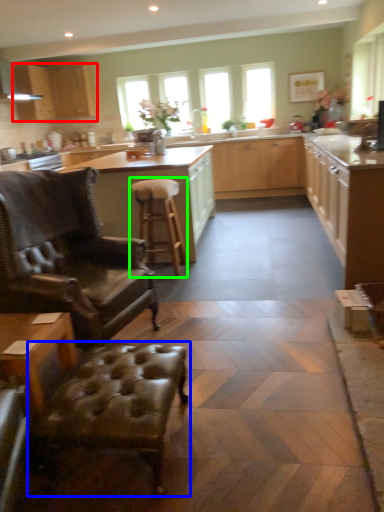
Question: Which object is the farthest from cabinetry (highlighted by a red box)? Choose among these: swivel chair (highlighted by a blue box) or stool (highlighted by a green box).

Choices:
 (A) swivel chair
 (B) stool

Answer: (A)